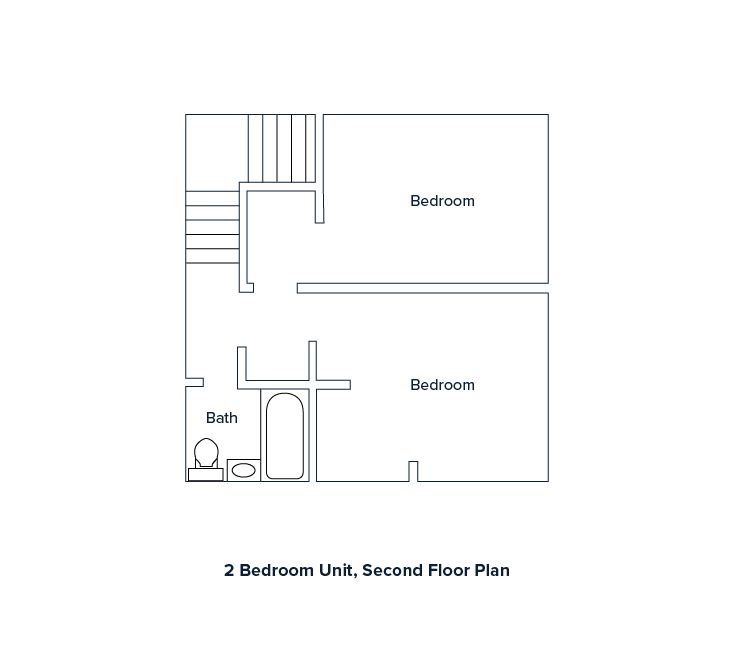
I want to click on outline of a bathtub, so click(x=266, y=435).